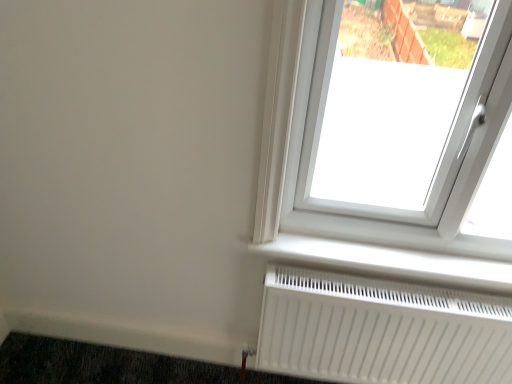
Describe the element at coordinates (390, 262) in the screenshot. The image size is (512, 384). I see `white plastic radiator at lower center` at that location.

This screenshot has width=512, height=384. Find the location of `white plastic radiator at lower center`. white plastic radiator at lower center is located at coordinates (390, 262).

Who is more distant, white plastic radiator at lower center or dark gray carpet at lower left?

dark gray carpet at lower left.

Between white plastic radiator at lower center and dark gray carpet at lower left, which one has larger width?

Wider between the two is dark gray carpet at lower left.

Considering the relative sizes of white plastic radiator at lower center and dark gray carpet at lower left in the image provided, is white plastic radiator at lower center smaller than dark gray carpet at lower left?

Yes, white plastic radiator at lower center is smaller than dark gray carpet at lower left.

Can you tell me how much white plastic radiator at lower center and dark gray carpet at lower left differ in facing direction?

white plastic radiator at lower center and dark gray carpet at lower left are facing 89.8 degrees away from each other.

From their relative heights in the image, would you say dark gray carpet at lower left is taller or shorter than white plastic radiator at lower center?

Considering their sizes, dark gray carpet at lower left has more height than white plastic radiator at lower center.

Looking at this image, what's the angular difference between dark gray carpet at lower left and white plastic radiator at lower center's facing directions?

They differ by 89.8 degrees in their facing directions.

Between dark gray carpet at lower left and white plastic radiator at lower center, which one appears on the right side from the viewer's perspective?

white plastic radiator at lower center.

Where is `doormat behind the white plastic radiator at lower center`? This screenshot has height=384, width=512. doormat behind the white plastic radiator at lower center is located at coordinates (99, 364).

Is white matte radiator at lower right at the back of white plastic radiator at lower center?

white plastic radiator at lower center is not turned away from white matte radiator at lower right.

From a real-world perspective, which is physically below, white plastic radiator at lower center or white matte radiator at lower right?

white matte radiator at lower right.

Does point (346, 259) come closer to viewer compared to point (337, 348)?

That is True.

Is white matte radiator at lower right facing towards dark gray carpet at lower left?

No, white matte radiator at lower right is not aimed at dark gray carpet at lower left.

Considering the relative sizes of white matte radiator at lower right and dark gray carpet at lower left in the image provided, is white matte radiator at lower right bigger than dark gray carpet at lower left?

Correct, white matte radiator at lower right is larger in size than dark gray carpet at lower left.

Considering the sizes of white matte radiator at lower right and dark gray carpet at lower left in the image, is white matte radiator at lower right taller or shorter than dark gray carpet at lower left?

Clearly, white matte radiator at lower right is taller compared to dark gray carpet at lower left.

From the picture: From a real-world perspective, is white matte radiator at lower right physically located above or below dark gray carpet at lower left?

In terms of real-world spatial position, white matte radiator at lower right is above dark gray carpet at lower left.

Who is smaller, dark gray carpet at lower left or white matte radiator at lower right?

dark gray carpet at lower left is smaller.

Based on the photo, from the image's perspective, is dark gray carpet at lower left located beneath white matte radiator at lower right?

Yes, from the image's perspective, dark gray carpet at lower left is below white matte radiator at lower right.

Does dark gray carpet at lower left turn towards white matte radiator at lower right?

No.

Consider the image. How different are the orientations of white matte radiator at lower right and white plastic radiator at lower center in degrees?

The angle between the facing direction of white matte radiator at lower right and the facing direction of white plastic radiator at lower center is 0.16 degrees.

Based on the photo, from a real-world perspective, relative to white plastic radiator at lower center, is white matte radiator at lower right vertically above or below?

From a real-world perspective, white matte radiator at lower right is physically below white plastic radiator at lower center.

Between white matte radiator at lower right and white plastic radiator at lower center, which one has larger width?

With larger width is white plastic radiator at lower center.

Is white matte radiator at lower right positioned with its back to white plastic radiator at lower center?

white matte radiator at lower right is not turned away from white plastic radiator at lower center.

I want to click on window sill in front of the dark gray carpet at lower left, so click(x=390, y=262).

I want to click on doormat lying on the left of white plastic radiator at lower center, so click(x=99, y=364).

Considering their positions, is dark gray carpet at lower left positioned further to white matte radiator at lower right than white plastic radiator at lower center?

The object further to white matte radiator at lower right is dark gray carpet at lower left.

Consider the image. Estimate the real-world distances between objects in this image. Which object is closer to dark gray carpet at lower left, white plastic radiator at lower center or white matte radiator at lower right?

white matte radiator at lower right is positioned closer to the anchor dark gray carpet at lower left.

Considering their positions, is white matte radiator at lower right positioned further to white plastic radiator at lower center than dark gray carpet at lower left?

Based on the image, dark gray carpet at lower left appears to be further to white plastic radiator at lower center.

When comparing their distances from dark gray carpet at lower left, does white matte radiator at lower right or white plastic radiator at lower center seem closer?

Based on the image, white matte radiator at lower right appears to be nearer to dark gray carpet at lower left.

Considering their positions, is white plastic radiator at lower center positioned closer to white matte radiator at lower right than dark gray carpet at lower left?

white plastic radiator at lower center is closer to white matte radiator at lower right.

Looking at the image, which one is located further to white plastic radiator at lower center, dark gray carpet at lower left or white matte radiator at lower right?

dark gray carpet at lower left lies further to white plastic radiator at lower center than the other object.

What are the coordinates of `window sill located between dark gray carpet at lower left and white matte radiator at lower right in the left-right direction` in the screenshot? It's located at (390, 262).